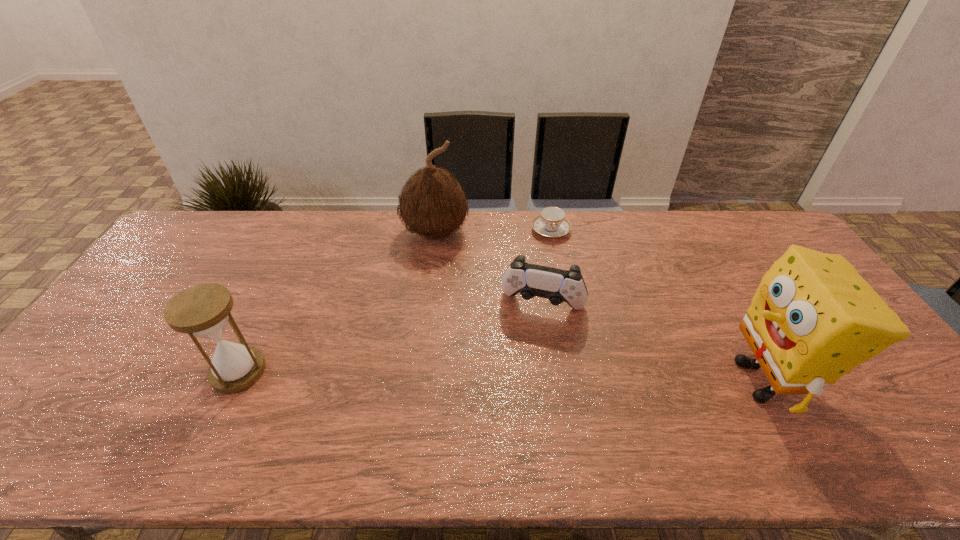
The height and width of the screenshot is (540, 960). Identify the location of free location located on the face of the rightmost object. (675, 380).

This screenshot has height=540, width=960. In order to click on free spot located 0.070m on the front-facing side of the third farthest object in this screenshot , I will do `click(529, 342)`.

Find the location of a particular element. Image resolution: width=960 pixels, height=540 pixels. vacant space situated on the front-facing side of the third farthest object is located at coordinates (528, 347).

The height and width of the screenshot is (540, 960). I want to click on vacant area located on the front-facing side of the third farthest object, so click(513, 409).

Locate an element on the screen. The width and height of the screenshot is (960, 540). free location located on the surface of the coconut is located at coordinates (432, 267).

Where is `vacant space located 0.210m on the surface of the coconut`? This screenshot has width=960, height=540. vacant space located 0.210m on the surface of the coconut is located at coordinates (428, 301).

At what (x,y) coordinates should I click in order to perform the action: click on vacant area situated 0.090m on the surface of the coconut. Please return your answer as a coordinate pair (x, y). Looking at the image, I should click on (431, 273).

This screenshot has height=540, width=960. In order to click on free space located 0.110m on the side with the handle of the teacup in this screenshot , I will do `click(555, 264)`.

You are a GUI agent. You are given a task and a screenshot of the screen. Output one action in this format:
    pyautogui.click(x=<x>, y=<y>)
    Task: Click on the vacant region located on the side with the handle of the teacup
    The image size is (960, 540).
    Given the screenshot: What is the action you would take?
    pyautogui.click(x=557, y=281)

Where is `free space located on the side with the handle of the teacup`? free space located on the side with the handle of the teacup is located at coordinates (555, 262).